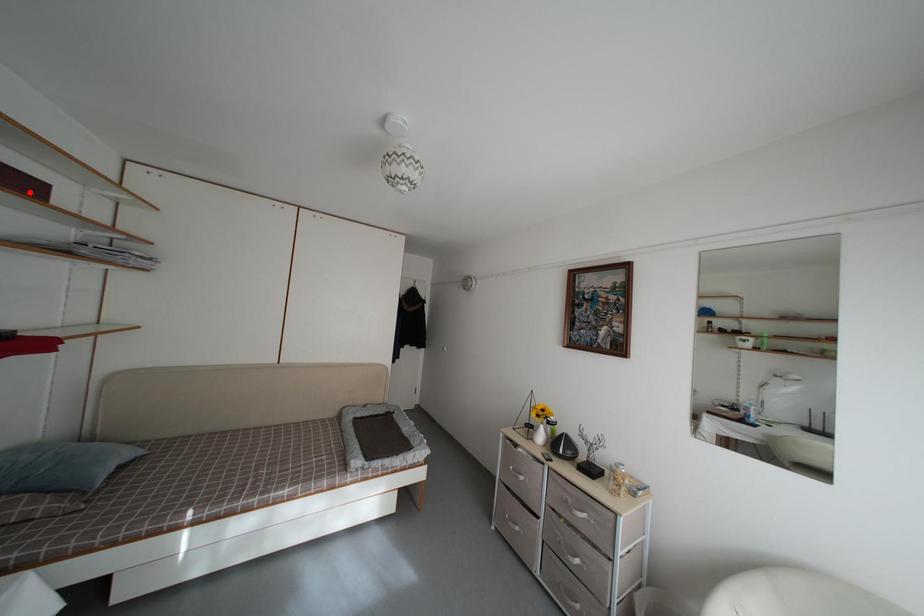
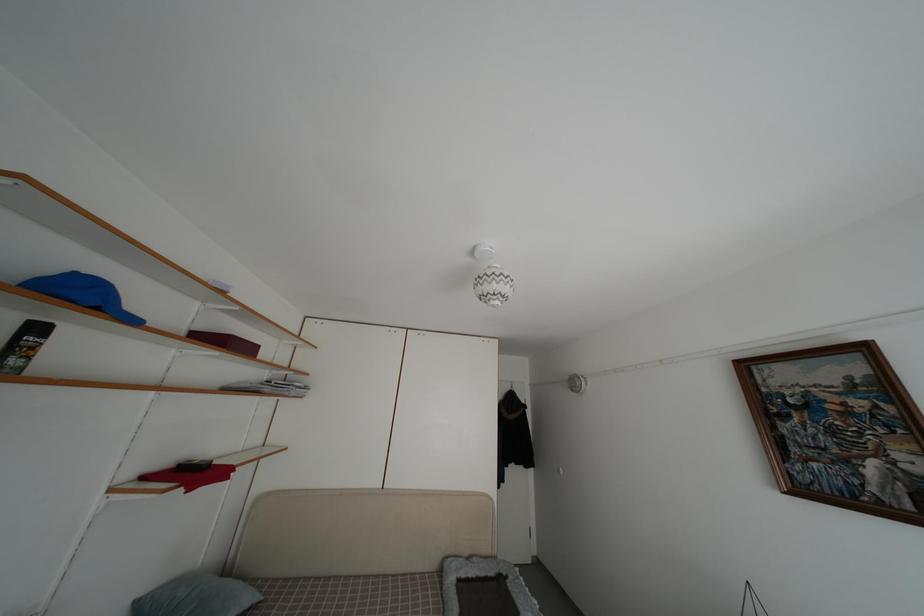
Question: I am providing you with two images of the same scene from different viewpoints. In image1, a red point is highlighted. Considering the same 3D point in image2, which of the following is correct?

Choices:
 (A) It is closer
 (B) It is farther

Answer: (B)